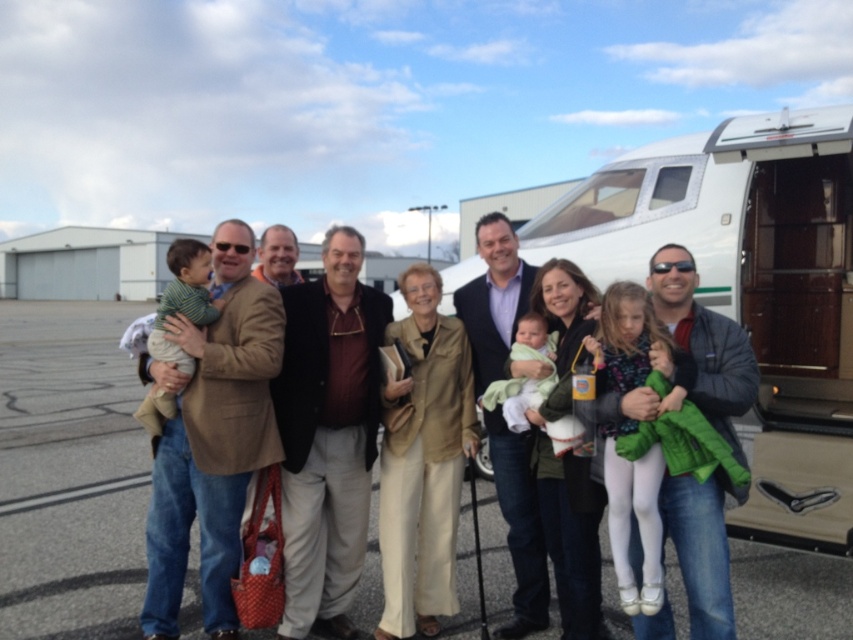
You are a photographer trying to capture a closeup of the matte brown jacket at center. Based on its coordinates, where should you position your camera relative to the group?

The matte brown jacket at center is located at point 0.644 on the x axis and 0.386 on the y axis, so you should position your camera slightly to the right and lower down to focus on the matte brown jacket at center.